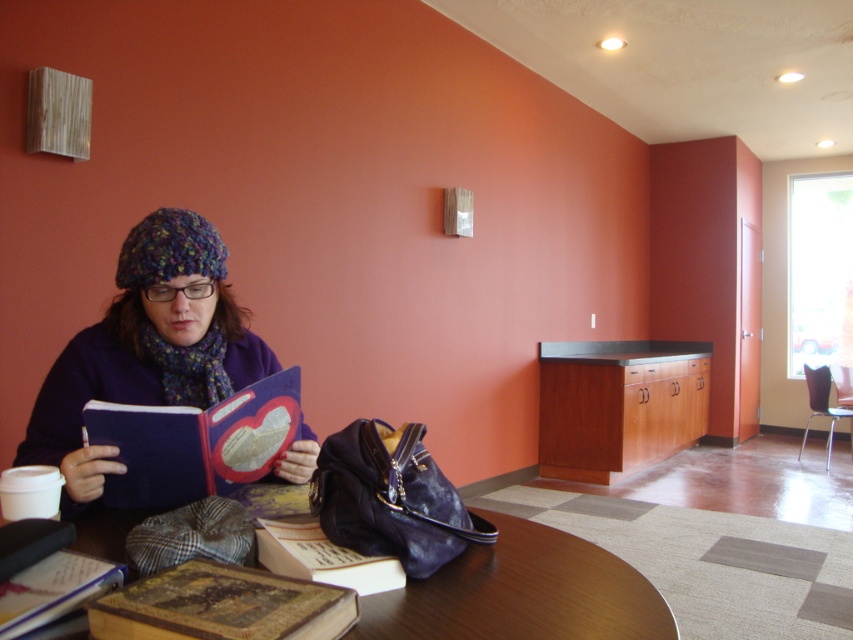
You are standing at the entrance of the study area and see two points marked on the floor. The first point is at coordinate point(22, 456) and the second point is at point(190, 609). Which point is closer to the entrance?

Point(22, 456) is behind point(190, 609), so the entrance is closer to point(190, 609).

You are standing in the library and want to place a small object between the two points marked as point (194, 259) and point (67, 580). Which point should you place it closer to in order to ensure it is closer to the viewer?

You should place the small object closer to point (194, 259) because it is closer to the viewer compared to point (67, 580).

You are standing at the entrance of the study area and see two points marked on the floor. The first point is at coordinate point (341, 600) and the second is at point (347, 560). Which point is closer to you?

Point (341, 600) is in front of point (347, 560), so the first point is closer to you.